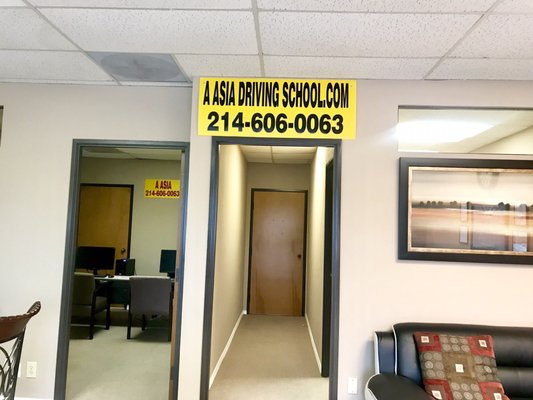
Locate an element on the screen. doorway is located at coordinates (209, 271).